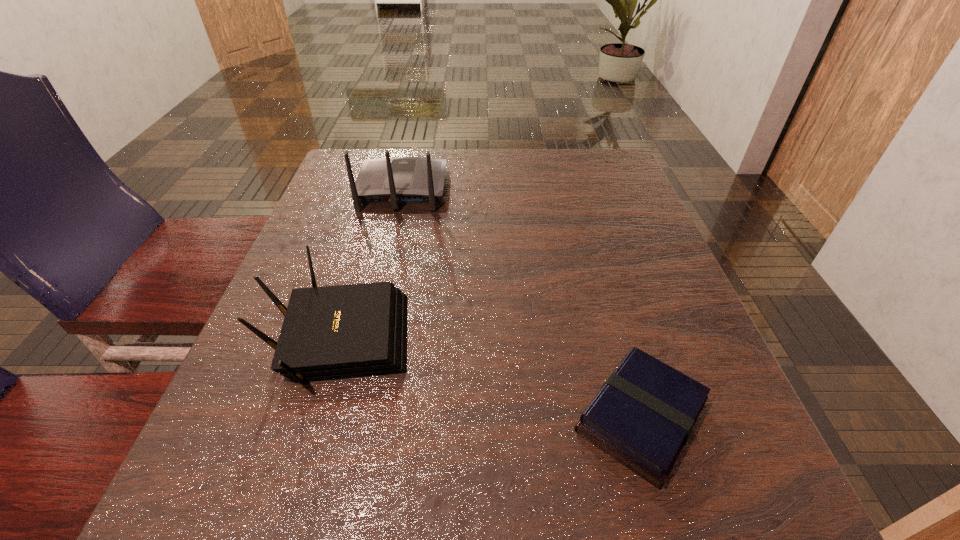
Select which object appears as the closest to the shortest object. Please provide its 2D coordinates. Your answer should be formatted as a tuple, i.e. [(x, y)], where the tuple contains the x and y coordinates of a point satisfying the conditions above.

[(336, 332)]

Locate which object is the closest to the farther router. Please provide its 2D coordinates. Your answer should be formatted as a tuple, i.e. [(x, y)], where the tuple contains the x and y coordinates of a point satisfying the conditions above.

[(336, 332)]

I want to click on free space that satisfies the following two spatial constraints: 1. on the front side of the book; 2. on the right side of the shorter router, so click(x=316, y=417).